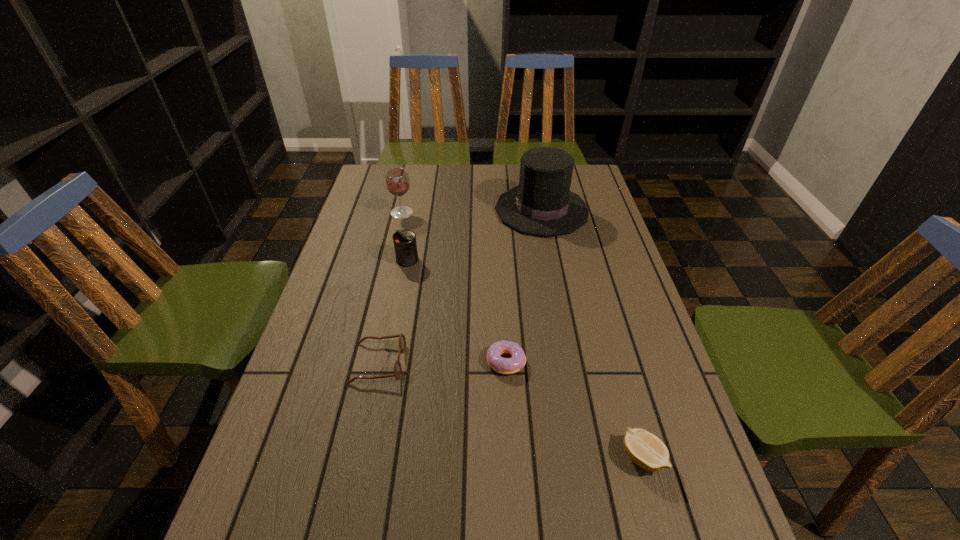
You are a GUI agent. You are given a task and a screenshot of the screen. Output one action in this format:
    pyautogui.click(x=<x>, y=<y>)
    Task: Click on the vacant region located on the back of the fifth shortest object
    The width and height of the screenshot is (960, 540).
    Given the screenshot: What is the action you would take?
    pyautogui.click(x=406, y=193)

Where is `blank area located 0.080m on the left of the can`? blank area located 0.080m on the left of the can is located at coordinates (370, 260).

Image resolution: width=960 pixels, height=540 pixels. What are the coordinates of `free space located on the front-facing side of the spectacles` in the screenshot? It's located at (538, 363).

Where is `vacant area situated on the back of the nearest object`? The width and height of the screenshot is (960, 540). vacant area situated on the back of the nearest object is located at coordinates (615, 359).

You are a GUI agent. You are given a task and a screenshot of the screen. Output one action in this format:
    pyautogui.click(x=<x>, y=<y>)
    Task: Click on the blank space located 0.170m on the left of the doughnut
    This screenshot has height=540, width=960.
    Given the screenshot: What is the action you would take?
    pyautogui.click(x=416, y=361)

Find the location of `object located at the far edge`. object located at the far edge is located at coordinates (543, 205).

Find the location of a particular element. wineglass situated at the left edge is located at coordinates [x=397, y=181].

This screenshot has height=540, width=960. In order to click on spectacles present at the left edge in this screenshot , I will do `click(402, 341)`.

I want to click on dress hat that is at the right edge, so click(543, 205).

What are the coordinates of `lemon that is positioned at the right edge` in the screenshot? It's located at (645, 449).